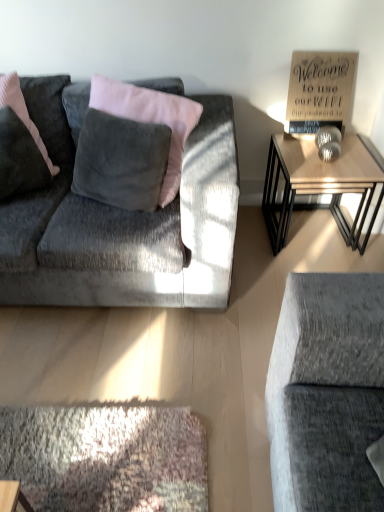
This screenshot has width=384, height=512. Find the location of `vacant space in wooden table at right (from a real-world perspective)`. vacant space in wooden table at right (from a real-world perspective) is located at coordinates (313, 231).